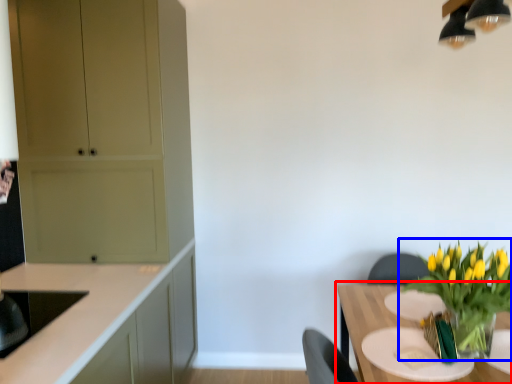
Question: Which object is closer to the camera taking this photo, table (highlighted by a red box) or houseplant (highlighted by a blue box)?

Choices:
 (A) table
 (B) houseplant

Answer: (A)